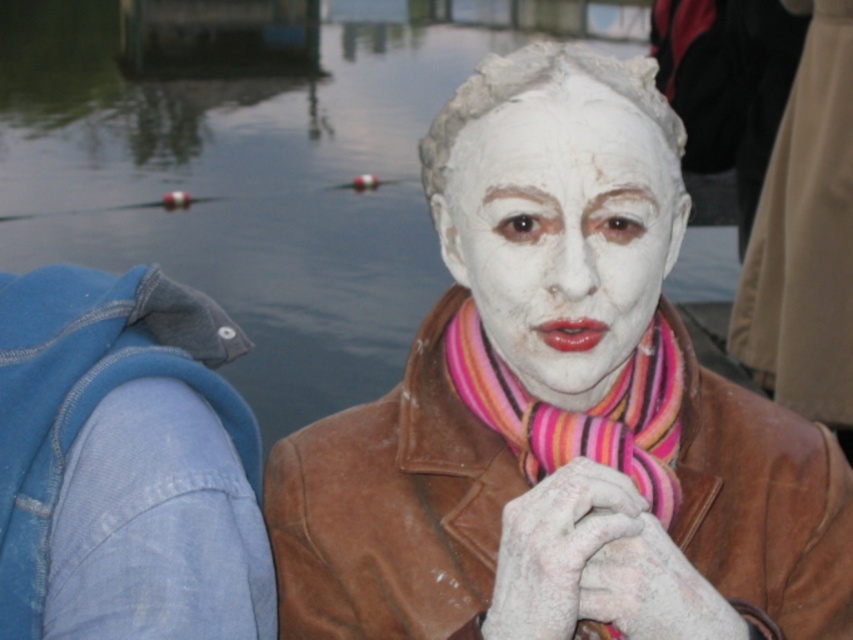
Looking at this image, you are an artist observing the scene. You notice the white clay mask at center and the striped wool scarf at center. Which object is positioned more to the left?

The white clay mask at center is positioned more to the left than the striped wool scarf at center.

You are an artist observing the scene and want to paint the white clay mask at center and the glossy water at center. Based on their positions, which object should you depict first in your painting to maintain proper perspective?

The white clay mask at center should be depicted first because it is positioned below the glossy water at center, meaning it is farther away from the viewer. In perspective drawing, objects further away are often sketched first to establish depth.

You are an observer standing in front of the image. You notice the denim jacket at left and the striped wool scarf at center. Which object is closer to you?

The denim jacket at left is closer to you because the striped wool scarf at center is behind it.